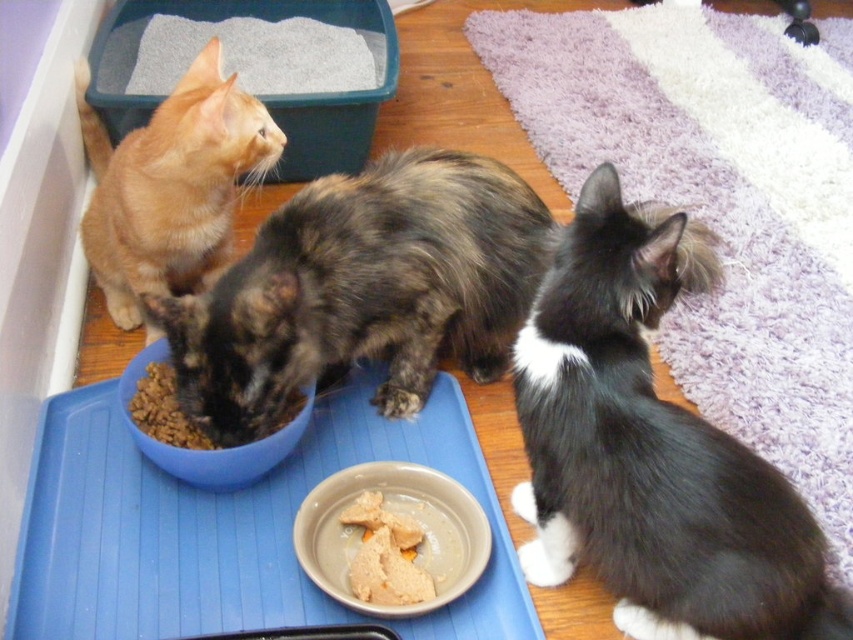
You are a cat owner who wants to ensure your pets have enough food. You notice the blue plastic bowl at center and the dry kibble at center. Can you determine if the bowl is large enough to hold more food for the cats?

The blue plastic bowl at center has a larger size compared to dry kibble at center, so yes, the bowl can hold more food for the cats.